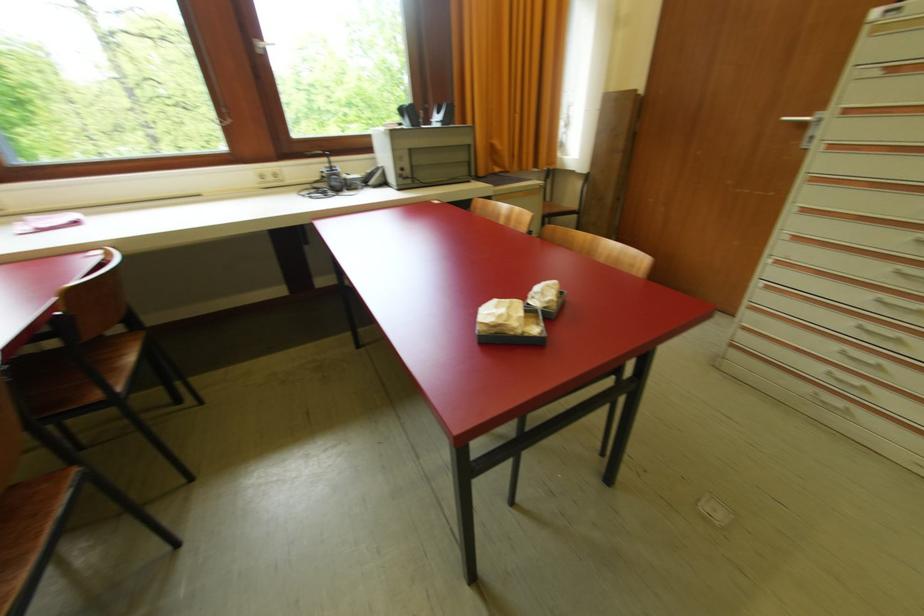
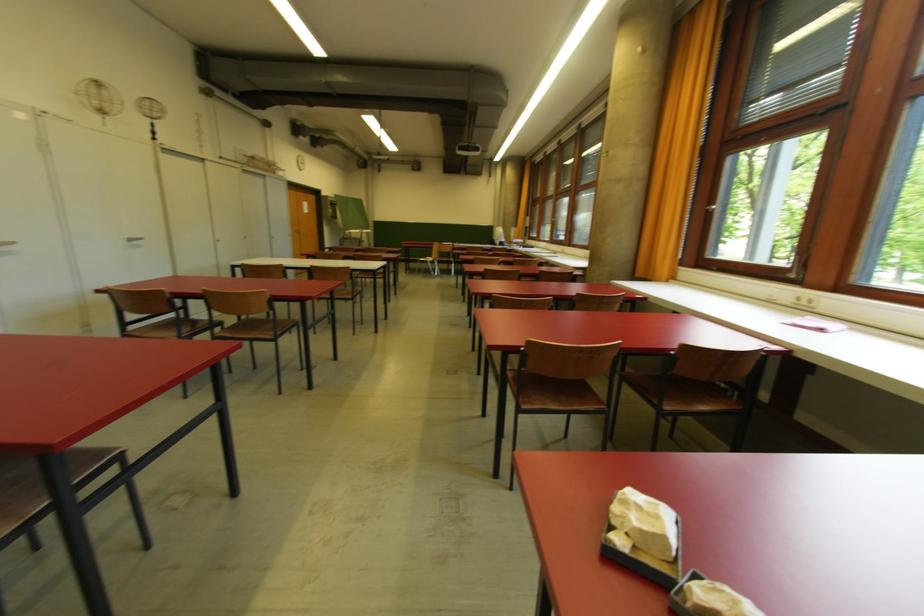
In the second image, find the point that corresponds to [553,306] in the first image.

(690, 596)